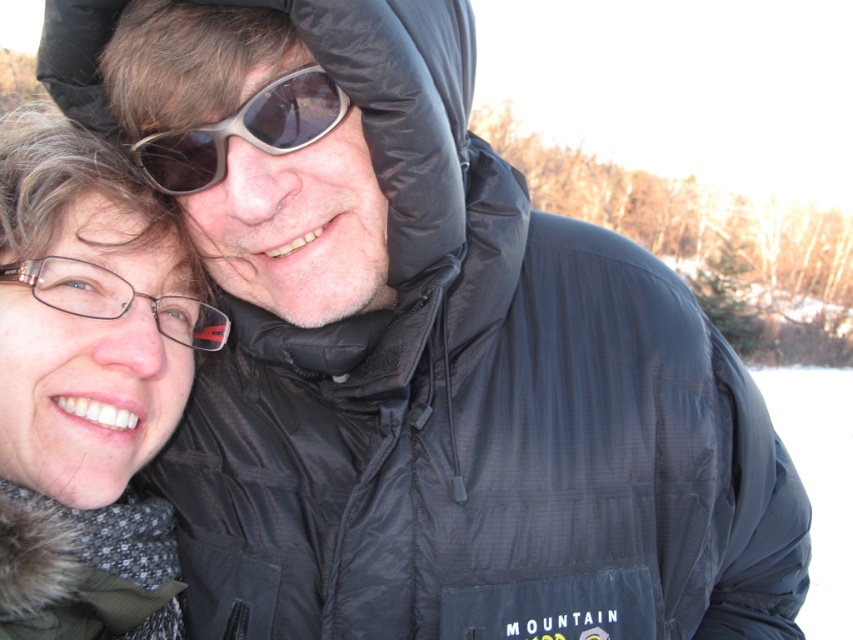
Who is shorter, matte black glasses at upper left or sunglasses at center?

→ sunglasses at center

Does matte black glasses at upper left appear under sunglasses at center?

Indeed, matte black glasses at upper left is positioned under sunglasses at center.

Who is more forward, (x=16, y=378) or (x=300, y=122)?

Point (x=300, y=122) is more forward.

Find the location of `matte black glasses at upper left`. matte black glasses at upper left is located at coordinates (86, 385).